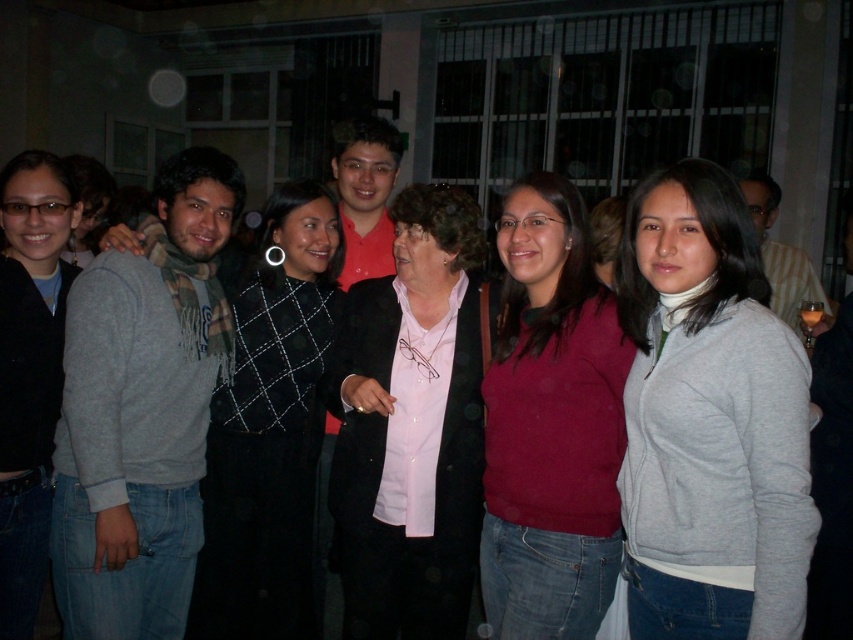
Does point (193, 413) come farther from viewer compared to point (618, 332)?

That is True.

What do you see at coordinates (141, 413) in the screenshot?
I see `gray fleece sweater at left` at bounding box center [141, 413].

Locate an element on the screen. Image resolution: width=853 pixels, height=640 pixels. gray fleece sweater at left is located at coordinates (141, 413).

Between matte black jacket at left and striped fabric shirt at right, which one has less height?

Standing shorter between the two is striped fabric shirt at right.

Does matte black jacket at left appear under striped fabric shirt at right?

Yes, matte black jacket at left is below striped fabric shirt at right.

Which is in front, point (1, 518) or point (775, 310)?

Point (1, 518) is more forward.

Where is `matte black jacket at left`? The width and height of the screenshot is (853, 640). matte black jacket at left is located at coordinates point(28,371).

Who is positioned more to the left, matte gray sweater at right or black diamond-patterned sweater at center?

From the viewer's perspective, black diamond-patterned sweater at center appears more on the left side.

Between matte gray sweater at right and black diamond-patterned sweater at center, which one is positioned higher?

matte gray sweater at right is higher up.

Which is in front, point (639, 292) or point (273, 371)?

Point (639, 292) is in front.

Locate an element on the screen. The width and height of the screenshot is (853, 640). matte gray sweater at right is located at coordinates (709, 420).